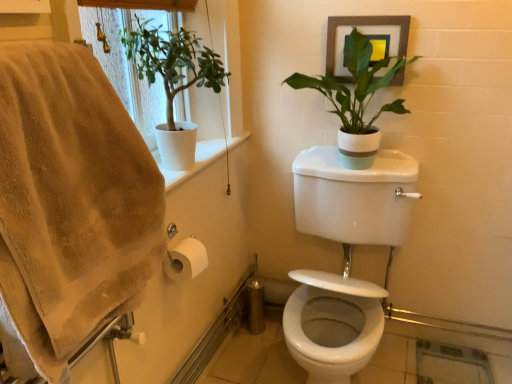
Question: Would you say white matte plant at upper left, the first houseplant viewed from the left, is inside or outside beige cotton bath towel at left?

Choices:
 (A) inside
 (B) outside

Answer: (B)

Question: From the image's perspective, is white matte plant at upper left, positioned as the 2th houseplant in right-to-left order, positioned above or below beige cotton bath towel at left?

Choices:
 (A) below
 (B) above

Answer: (B)

Question: Which object is positioned closest to the beige cotton bath towel at left?

Choices:
 (A) white matte pot at upper right, which is counted as the 2th houseplant, starting from the left
 (B) white glossy toilet at center
 (C) white matte plant at upper left, positioned as the 2th houseplant in right-to-left order
 (D) wooden framed picture at upper right

Answer: (C)

Question: Considering the real-world distances, which object is farthest from the white glossy toilet at center?

Choices:
 (A) beige cotton bath towel at left
 (B) wooden framed picture at upper right
 (C) white matte plant at upper left, the first houseplant viewed from the left
 (D) white matte pot at upper right, which is counted as the first houseplant, starting from the right

Answer: (A)